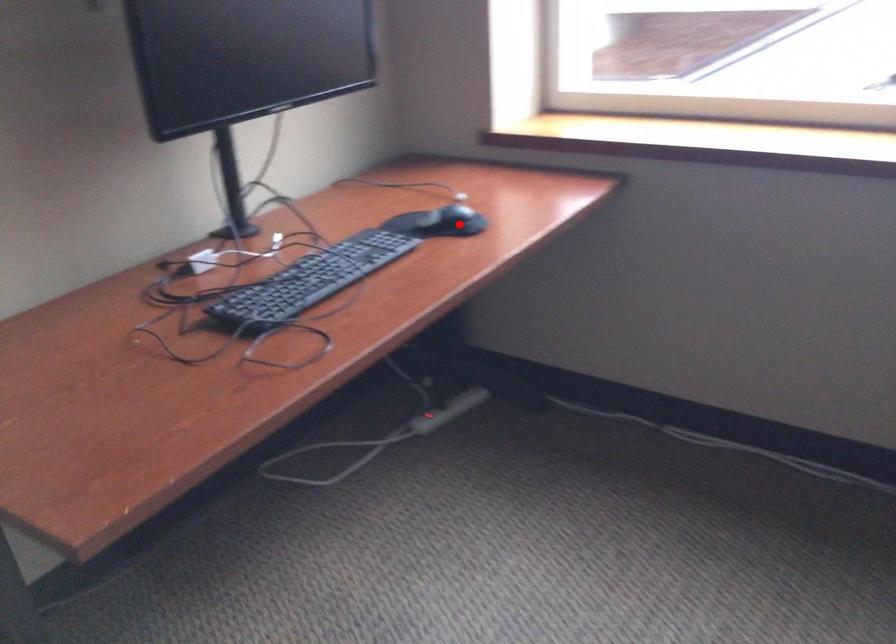
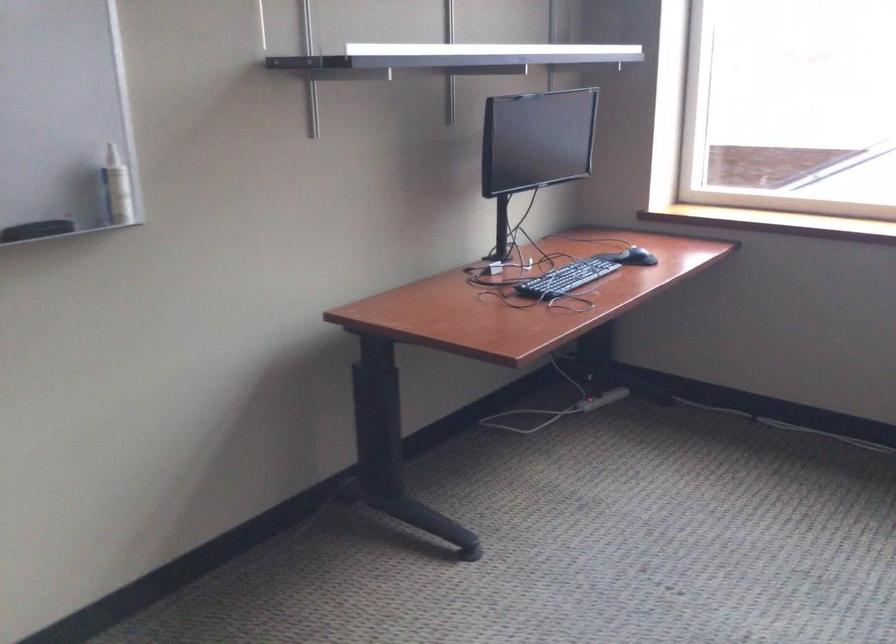
Question: I am providing you with two images of the same scene from different viewpoints. Given a red point in image1, look at the same physical point in image2. Is it:

Choices:
 (A) Closer to the viewpoint
 (B) Farther from the viewpoint

Answer: (B)